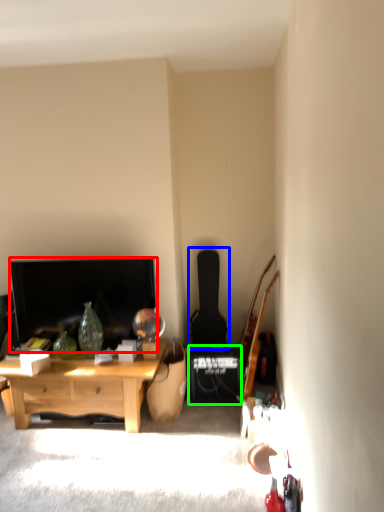
Question: Which object is positioned closest to television (highlighted by a red box)? Select from guitar (highlighted by a blue box) and speaker (highlighted by a green box).

Choices:
 (A) guitar
 (B) speaker

Answer: (B)